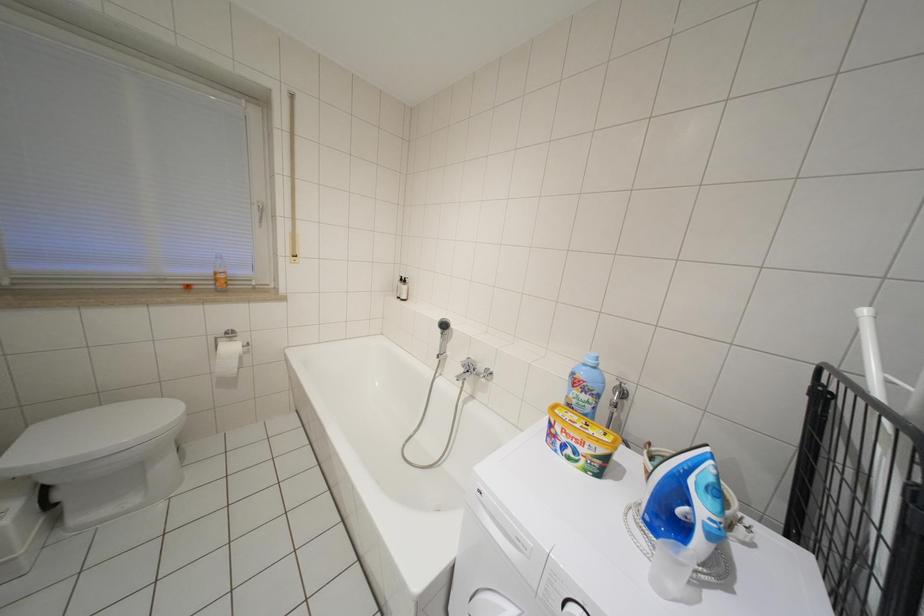
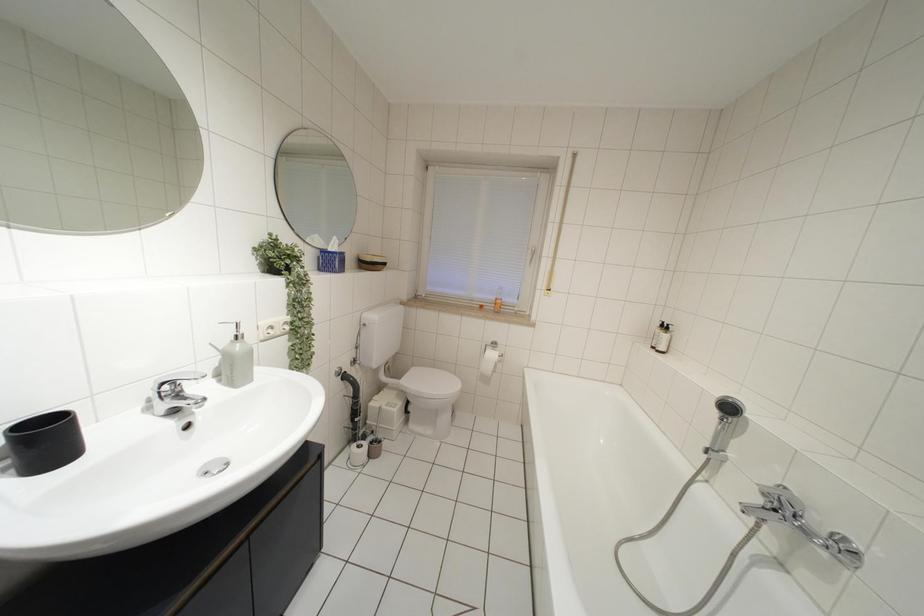
Question: The images are taken continuously from a first-person perspective. In which direction is your viewpoint rotating?

Choices:
 (A) Left
 (B) Right
 (C) Up
 (D) Down

Answer: (A)